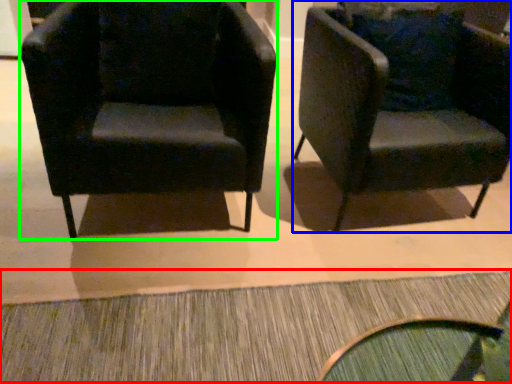
Question: Which object is positioned closest to doormat (highlighted by a red box)? Select from chair (highlighted by a blue box) and chair (highlighted by a green box).

Choices:
 (A) chair
 (B) chair

Answer: (B)